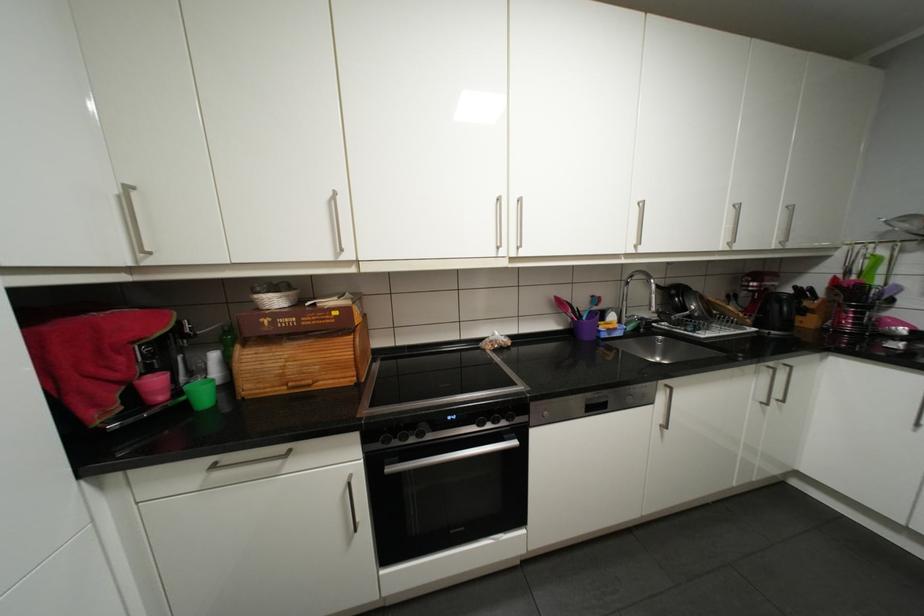
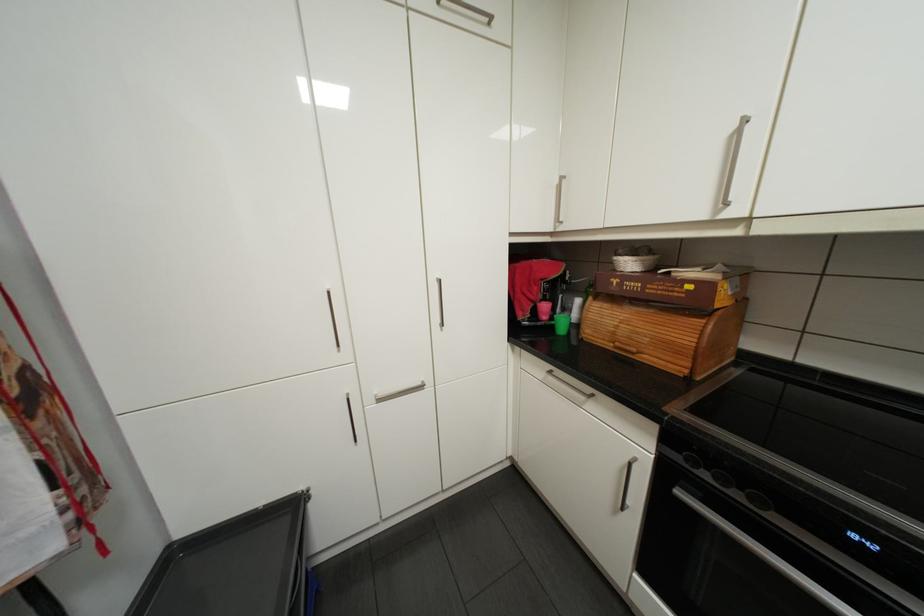
Where in the second image is the point corresponding to (391,442) from the first image?

(695, 459)